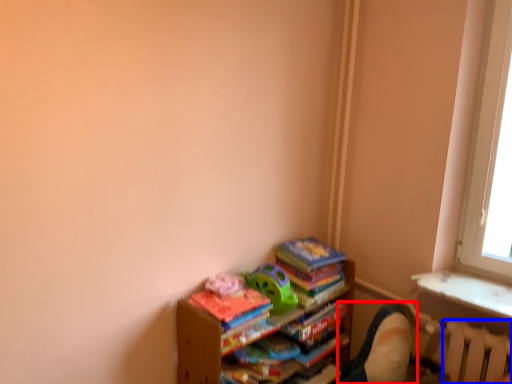
Question: Which object is closer to the camera taking this photo, swivel chair (highlighted by a red box) or radiator (highlighted by a blue box)?

Choices:
 (A) swivel chair
 (B) radiator

Answer: (B)